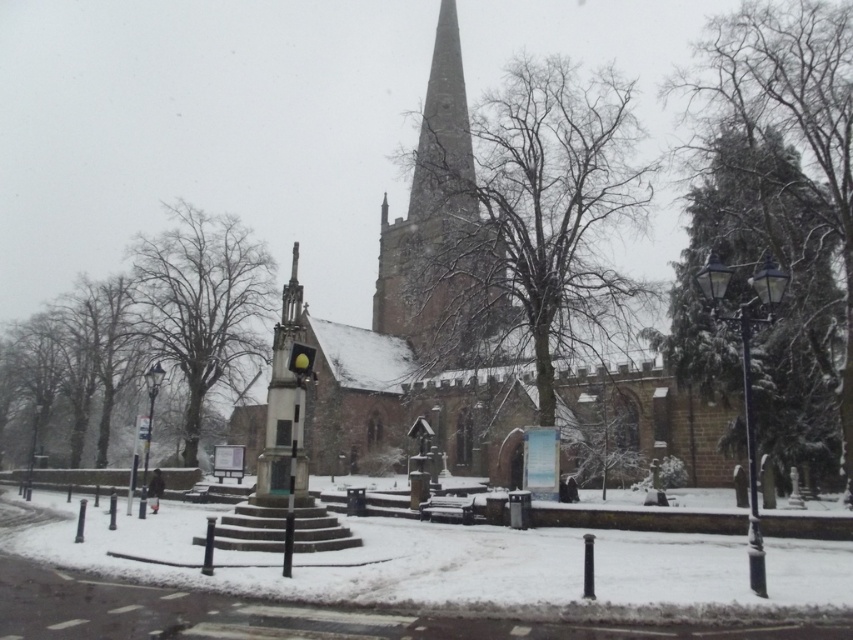
Question: Can you confirm if brown stone church at center is bigger than smooth stone spire at center?

Choices:
 (A) no
 (B) yes

Answer: (B)

Question: Which object appears closest to the camera in this image?

Choices:
 (A) brown stone church at center
 (B) smooth stone spire at center

Answer: (A)

Question: Can you confirm if brown stone church at center is positioned above smooth stone spire at center?

Choices:
 (A) yes
 (B) no

Answer: (B)

Question: Which of the following is the farthest from the observer?

Choices:
 (A) (334, 410)
 (B) (444, 12)

Answer: (B)

Question: Which object is closer to the camera taking this photo?

Choices:
 (A) brown stone church at center
 (B) smooth stone spire at center

Answer: (A)

Question: Can you confirm if brown stone church at center is wider than smooth stone spire at center?

Choices:
 (A) no
 (B) yes

Answer: (B)